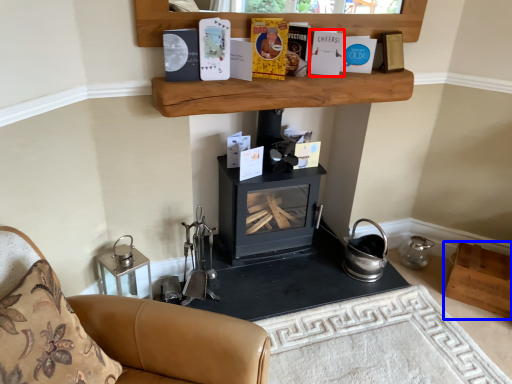
Question: Which of the following is the closest to the observer, paperback book (highlighted by a red box) or shelf (highlighted by a blue box)?

Choices:
 (A) paperback book
 (B) shelf

Answer: (A)